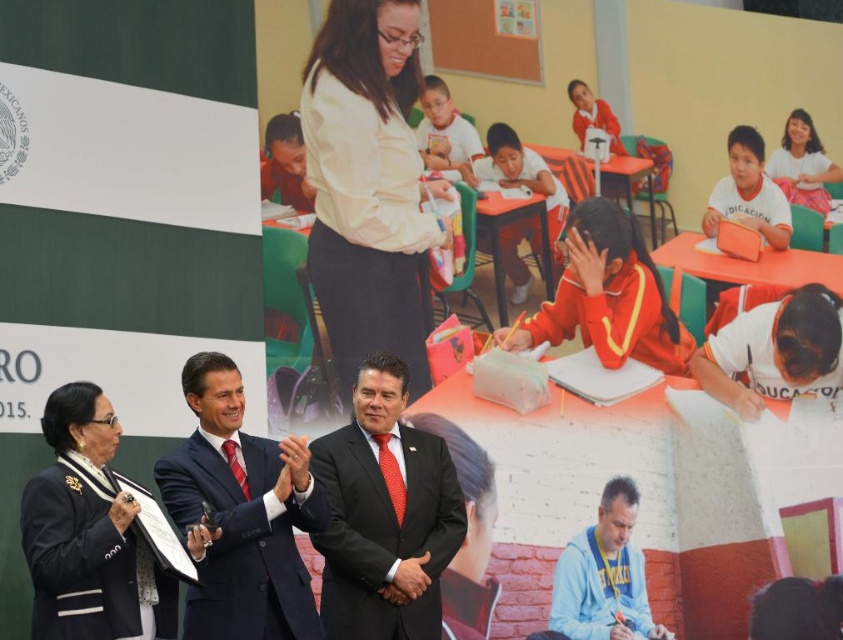
Does shiny black suit at center appear on the right side of matte white shirt at upper right?

In fact, shiny black suit at center is to the left of matte white shirt at upper right.

Between shiny black suit at center and matte white shirt at upper right, which one is positioned lower?

shiny black suit at center

I want to click on shiny black suit at center, so click(384, 515).

Where is `black leather jacket at lower left`? The width and height of the screenshot is (843, 640). black leather jacket at lower left is located at coordinates (89, 532).

Who is taller, black leather jacket at lower left or matte white shirt at upper right?

matte white shirt at upper right is taller.

Is point (100, 464) more distant than point (788, 163)?

No.

The height and width of the screenshot is (640, 843). In order to click on black leather jacket at lower left in this screenshot , I will do `click(89, 532)`.

Looking at this image, is shiny dark suit at center to the right of orange fabric uniform at center from the viewer's perspective?

In fact, shiny dark suit at center is to the left of orange fabric uniform at center.

Does shiny dark suit at center have a lesser width compared to orange fabric uniform at center?

Incorrect, shiny dark suit at center's width is not less than orange fabric uniform at center's.

Where is `shiny dark suit at center`? Image resolution: width=843 pixels, height=640 pixels. shiny dark suit at center is located at coordinates (240, 513).

Where is `shiny dark suit at center`? shiny dark suit at center is located at coordinates (240, 513).